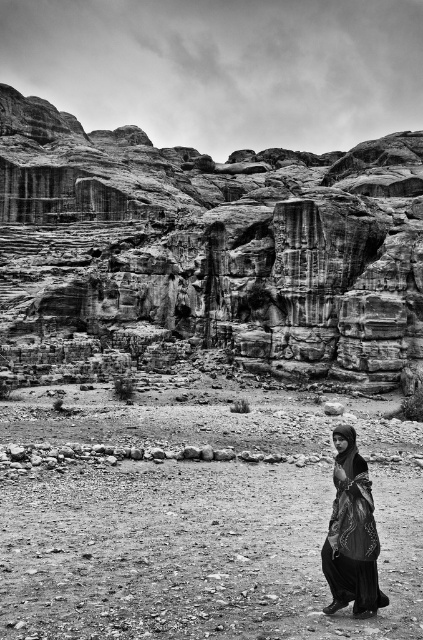
Can you confirm if dirt field at lower center is bigger than black satin dress at lower right?

Correct, dirt field at lower center is larger in size than black satin dress at lower right.

Which is in front, point (268, 449) or point (362, 468)?

Point (362, 468)

I want to click on dirt field at lower center, so click(x=197, y=522).

This screenshot has height=640, width=423. What do you see at coordinates (208, 252) in the screenshot? I see `rugged stone cliffs at upper left` at bounding box center [208, 252].

How much distance is there between rugged stone cliffs at upper left and dirt field at lower center?

rugged stone cliffs at upper left is 55.52 meters away from dirt field at lower center.

Is point (114, 196) farther from camera compared to point (321, 592)?

Yes, point (114, 196) is farther from viewer.

The height and width of the screenshot is (640, 423). What are the coordinates of `rugged stone cliffs at upper left` in the screenshot? It's located at tap(208, 252).

Does rugged stone cliffs at upper left lie in front of black satin dress at lower right?

No, rugged stone cliffs at upper left is further to the viewer.

Which is more to the right, rugged stone cliffs at upper left or black satin dress at lower right?

black satin dress at lower right is more to the right.

Which is behind, point (194, 170) or point (357, 520)?

Point (194, 170)

This screenshot has width=423, height=640. Find the location of `rugged stone cliffs at upper left`. rugged stone cliffs at upper left is located at coordinates (208, 252).